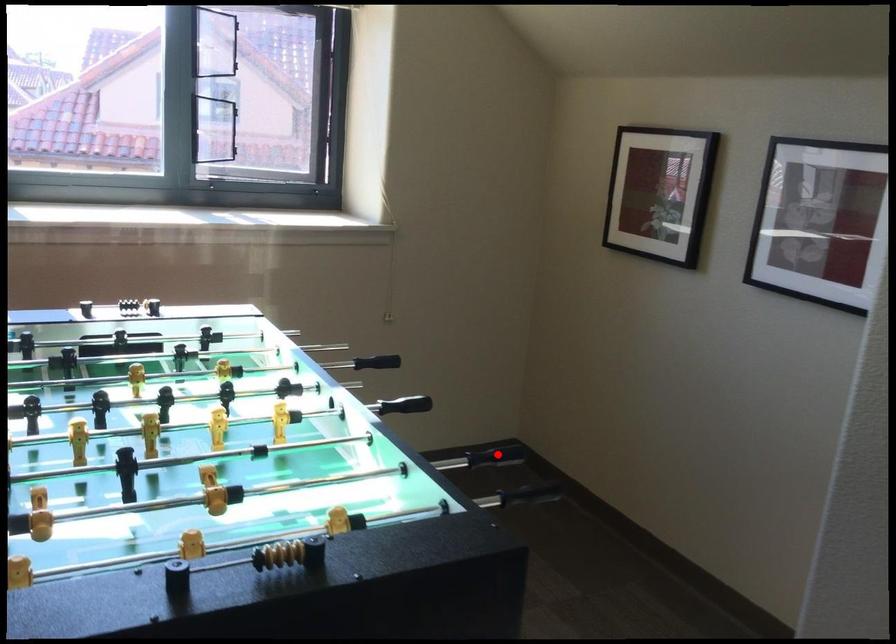
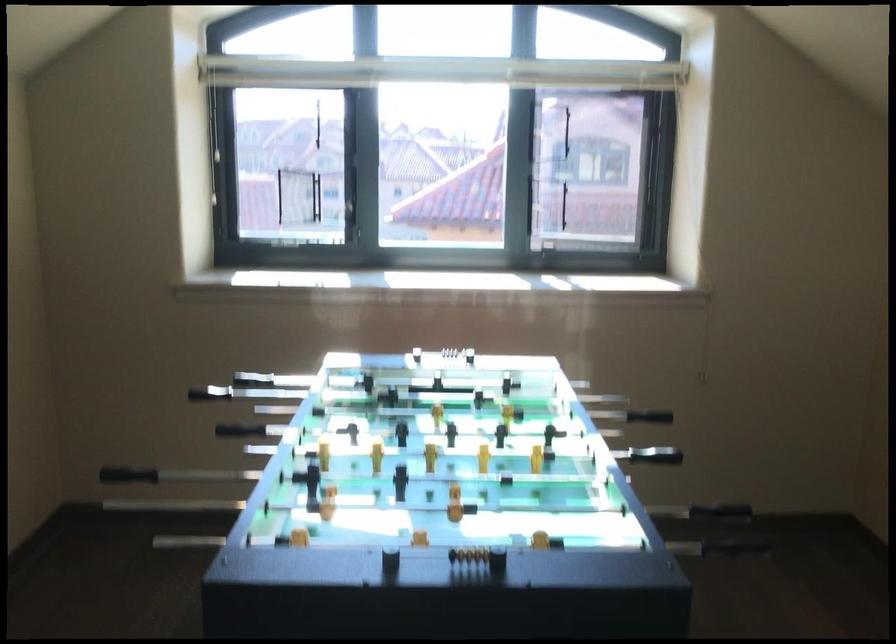
In the second image, find the point that corresponds to the highlighted location in the first image.

(724, 514)